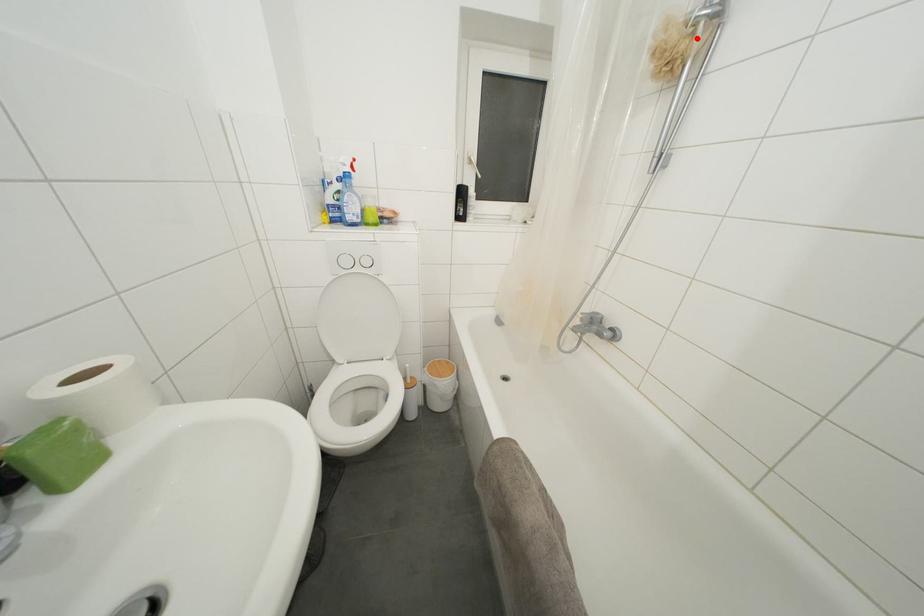
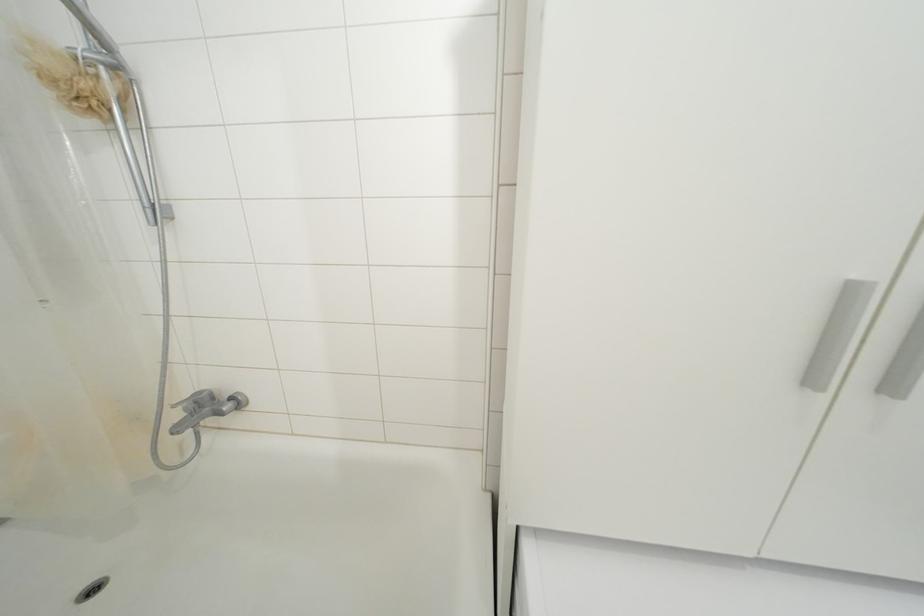
In the second image, find the point that corresponds to the highlighted location in the first image.

(100, 79)